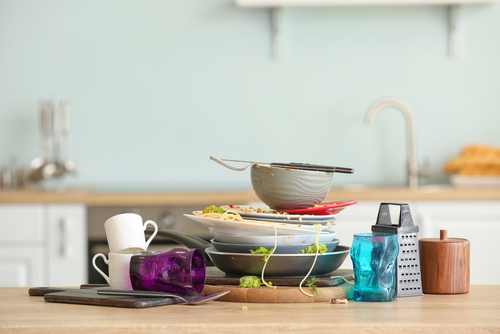
Locate an element on the screen. cups and glasses is located at coordinates (163, 273), (122, 265), (129, 231), (377, 257).